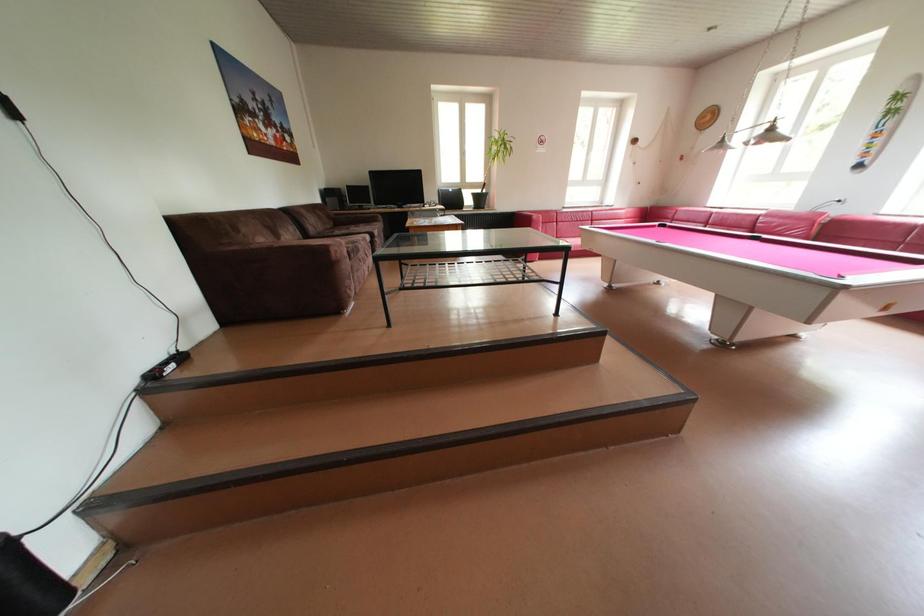
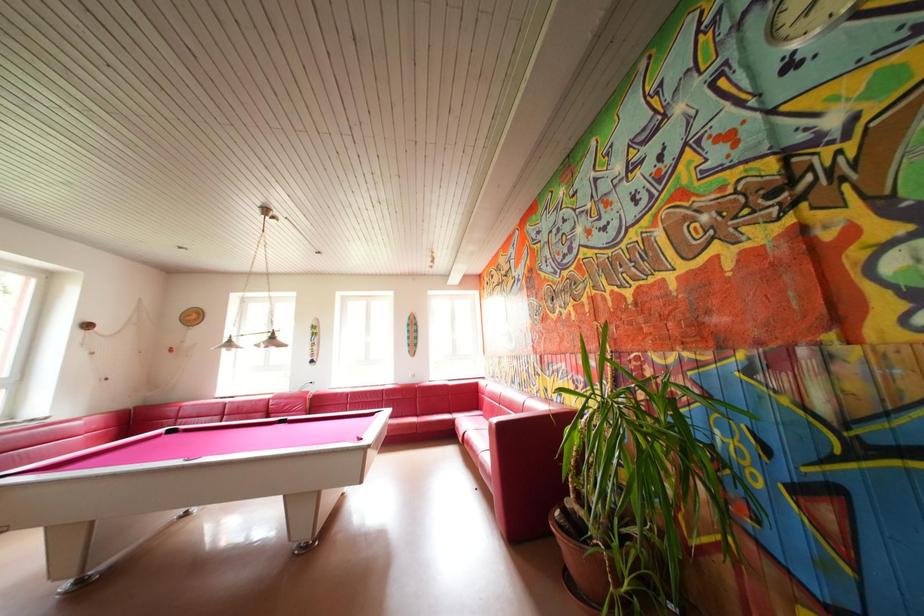
Question: The images are taken continuously from a first-person perspective. In which direction is your viewpoint rotating?

Choices:
 (A) Left
 (B) Right
 (C) Up
 (D) Down

Answer: (B)